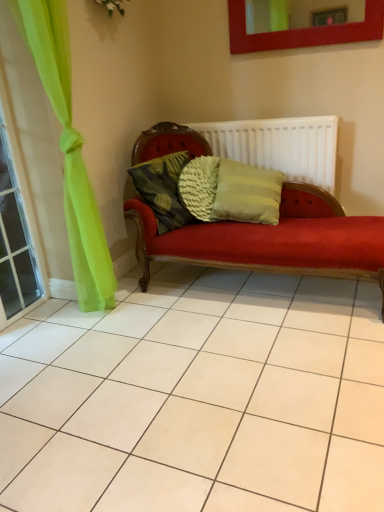
What are the coordinates of `matte red picture frame at upper center` in the screenshot? It's located at (303, 31).

Find the location of a particular element. This screenshot has width=384, height=512. green sheer curtain at left is located at coordinates (16, 240).

Is white ribbed radiator at center bigger than woven fabric pillow at center?

Yes.

Based on the photo, is white ribbed radiator at center positioned in front of woven fabric pillow at center?

No, it is not.

How many degrees apart are the facing directions of white ribbed radiator at center and woven fabric pillow at center?

The angular difference between white ribbed radiator at center and woven fabric pillow at center is 74.4 degrees.

Is woven fabric pillow at center looking in the opposite direction of white ribbed radiator at center?

woven fabric pillow at center is not turned away from white ribbed radiator at center.

From the image's perspective, which one is positioned lower, woven fabric pillow at center or white ribbed radiator at center?

woven fabric pillow at center appears lower in the image.

Is woven fabric pillow at center bigger than white ribbed radiator at center?

Incorrect, woven fabric pillow at center is not larger than white ribbed radiator at center.

Can you tell me how much matte red picture frame at upper center and white ribbed radiator at center differ in facing direction?

There is a 1.24-degree angle between the facing directions of matte red picture frame at upper center and white ribbed radiator at center.

Does point (229, 16) come closer to viewer compared to point (297, 135)?

No.

From a real-world perspective, is matte red picture frame at upper center positioned above or below white ribbed radiator at center?

Clearly, from a real-world perspective, matte red picture frame at upper center is above white ribbed radiator at center.

From the image's perspective, who appears lower, matte red picture frame at upper center or white ribbed radiator at center?

From the image's view, white ribbed radiator at center is below.

How much distance is there between woven fabric pillow at center and matte red picture frame at upper center?

A distance of 1.00 meters exists between woven fabric pillow at center and matte red picture frame at upper center.

From a real-world perspective, is woven fabric pillow at center positioned above or below matte red picture frame at upper center?

From a real-world perspective, woven fabric pillow at center is physically below matte red picture frame at upper center.

Which of these two, woven fabric pillow at center or matte red picture frame at upper center, is thinner?

matte red picture frame at upper center is thinner.

From the image's perspective, is woven fabric pillow at center on top of matte red picture frame at upper center?

No, from the image's perspective, woven fabric pillow at center is not on top of matte red picture frame at upper center.

Considering the relative sizes of white ribbed radiator at center and green sheer curtain at left in the image provided, is white ribbed radiator at center smaller than green sheer curtain at left?

Actually, white ribbed radiator at center might be larger than green sheer curtain at left.

From the image's perspective, which one is positioned lower, white ribbed radiator at center or green sheer curtain at left?

green sheer curtain at left is shown below in the image.

Between white ribbed radiator at center and green sheer curtain at left, which one has less height?

With less height is white ribbed radiator at center.

Locate an element on the screen. pillow to the right of green sheer curtain at left is located at coordinates (163, 189).

In the scene shown: Considering the sizes of objects green sheer curtain at left and woven fabric pillow at center in the image provided, who is taller, green sheer curtain at left or woven fabric pillow at center?

green sheer curtain at left is taller.

Between green sheer curtain at left and woven fabric pillow at center, which one has smaller size?

woven fabric pillow at center.

Is matte red picture frame at upper center a part of white ribbed radiator at center?

No, matte red picture frame at upper center is not a part of white ribbed radiator at center.

From a real-world perspective, is white ribbed radiator at center located beneath matte red picture frame at upper center?

Yes, from a real-world perspective, white ribbed radiator at center is below matte red picture frame at upper center.

Where is `picture frame in front of the white ribbed radiator at center`? The width and height of the screenshot is (384, 512). picture frame in front of the white ribbed radiator at center is located at coordinates (303, 31).

Between white ribbed radiator at center and matte red picture frame at upper center, which one has smaller width?

Thinner between the two is matte red picture frame at upper center.

You are a GUI agent. You are given a task and a screenshot of the screen. Output one action in this format:
    pyautogui.click(x=<x>, y=<y>)
    Task: Click on the pillow below the white ribbed radiator at center (from a real-world perspective)
    
    Given the screenshot: What is the action you would take?
    pyautogui.click(x=163, y=189)

At what (x,y) coordinates should I click in order to perform the action: click on radiator that appears behind the woven fabric pillow at center. Please return your answer as a coordinate pair (x, y). The image size is (384, 512). Looking at the image, I should click on (279, 146).

In the scene shown: From the image, which object appears to be farther from woven fabric pillow at center, green sheer curtain at left or matte red picture frame at upper center?

matte red picture frame at upper center is positioned further to the anchor woven fabric pillow at center.

Considering their positions, is matte red picture frame at upper center positioned further to white ribbed radiator at center than green sheer curtain at left?

The object further to white ribbed radiator at center is green sheer curtain at left.

Looking at the image, which one is located closer to matte red picture frame at upper center, white ribbed radiator at center or woven fabric pillow at center?

white ribbed radiator at center.

Which object lies further to the anchor point green sheer curtain at left, white ribbed radiator at center or woven fabric pillow at center?

Among the two, white ribbed radiator at center is located further to green sheer curtain at left.

From the image, which object appears to be nearer to white ribbed radiator at center, green sheer curtain at left or matte red picture frame at upper center?

Among the two, matte red picture frame at upper center is located nearer to white ribbed radiator at center.

Estimate the real-world distances between objects in this image. Which object is further from white ribbed radiator at center, woven fabric pillow at center or green sheer curtain at left?

green sheer curtain at left is further to white ribbed radiator at center.

Based on their spatial positions, is green sheer curtain at left or woven fabric pillow at center further from white ribbed radiator at center?

Among the two, green sheer curtain at left is located further to white ribbed radiator at center.

Which object lies further to the anchor point green sheer curtain at left, woven fabric pillow at center or matte red picture frame at upper center?

matte red picture frame at upper center is positioned further to the anchor green sheer curtain at left.

Identify the location of radiator between matte red picture frame at upper center and woven fabric pillow at center vertically. This screenshot has width=384, height=512. [279, 146].

Locate an element on the screen. This screenshot has height=512, width=384. pillow between green sheer curtain at left and matte red picture frame at upper center is located at coordinates (163, 189).

The width and height of the screenshot is (384, 512). What are the coordinates of `pillow situated between green sheer curtain at left and white ribbed radiator at center from left to right` in the screenshot? It's located at (163, 189).

You are a GUI agent. You are given a task and a screenshot of the screen. Output one action in this format:
    pyautogui.click(x=<x>, y=<y>)
    Task: Click on the radiator between green sheer curtain at left and matte red picture frame at upper center in the horizontal direction
    The image size is (384, 512).
    Given the screenshot: What is the action you would take?
    pyautogui.click(x=279, y=146)